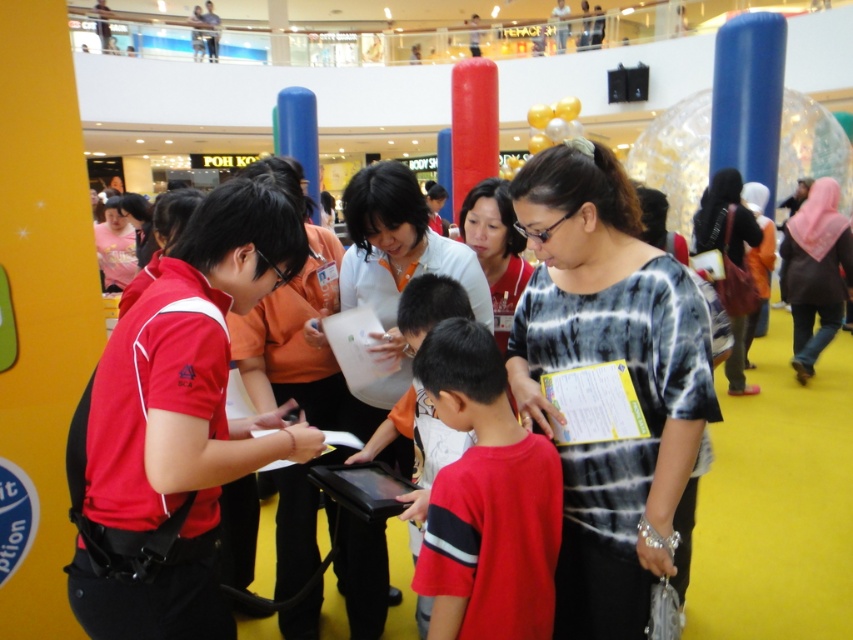
You are organizing a small event and need to place a 2 meter long table between the white matte shirt at center and the matte black shirt at right. Will there be enough space to place the table between them?

The distance between the white matte shirt at center and the matte black shirt at right is 3.88 meters. Since the table is 2 meters long, there is sufficient space to place it between them as 3.88 meters is greater than 2 meters.

You are organizing a photo shoot and need to decide which garment to use as a backdrop. The backdrop needs to be wider than the other garment. Which one should you choose between the white matte shirt at center and the pink fabric hijab at right?

The pink fabric hijab at right should be chosen as the backdrop because it is wider than the white matte shirt at center.

You are at the shopping mall and need to find the white matte shirt at center. According to the image, where exactly is it positioned?

The white matte shirt at center is located at point 0.405 on the x coordinate and 0.450 on the y coordinate.